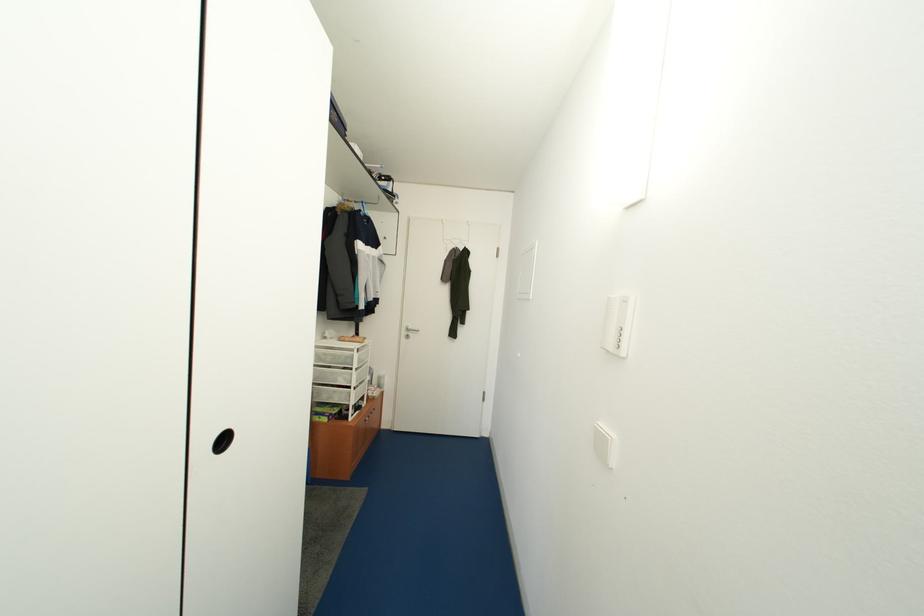
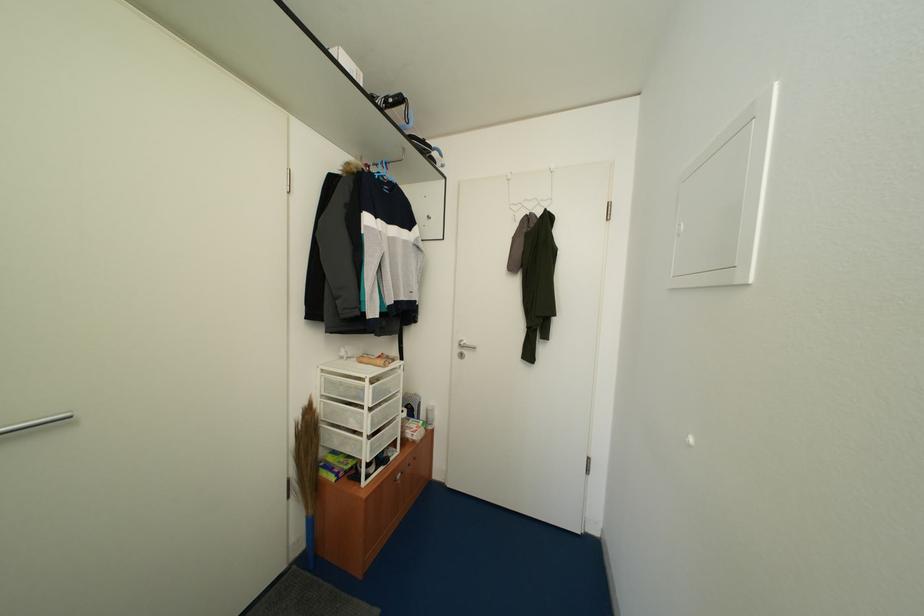
Question: In a continuous first-person perspective shot, in which direction is the camera moving?

Choices:
 (A) Left
 (B) Right
 (C) Forward
 (D) Backward

Answer: (C)